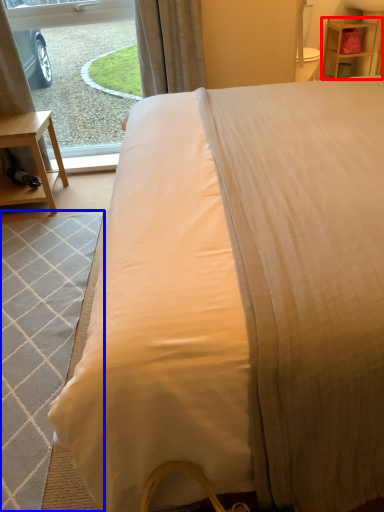
Question: Which point is further to the camera, nightstand (highlighted by a red box) or mat (highlighted by a blue box)?

Choices:
 (A) nightstand
 (B) mat

Answer: (A)